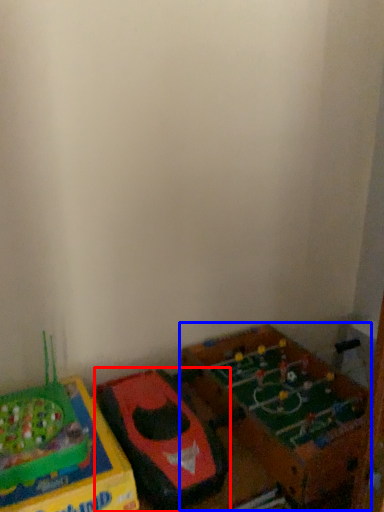
Question: Which point is further to the camera, toy (highlighted by a red box) or toy (highlighted by a blue box)?

Choices:
 (A) toy
 (B) toy

Answer: (B)